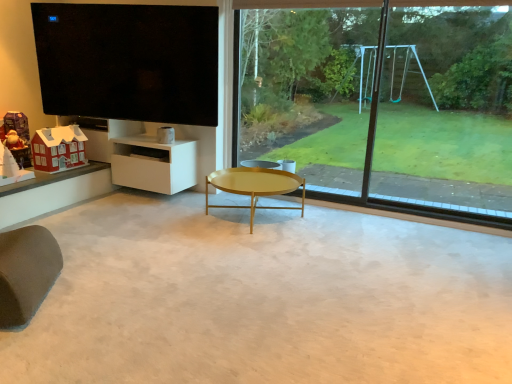
Identify the location of vacant area that is situated to the right of gold metallic coffee table at center. (348, 225).